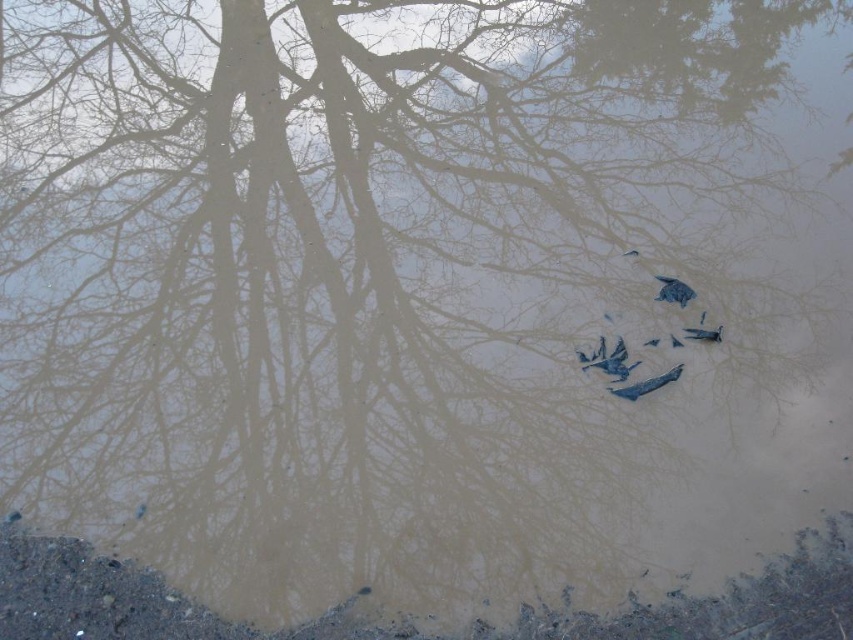
Which is below, blue paper at center or blue matte bird at center?

blue paper at center is below.

Which is in front, point (665, 378) or point (671, 301)?

Positioned in front is point (665, 378).

Locate an element on the screen. blue paper at center is located at coordinates (646, 385).

Can you confirm if muddy brown at bottom is positioned above blue feathered bird at center?

No, muddy brown at bottom is not above blue feathered bird at center.

You are a GUI agent. You are given a task and a screenshot of the screen. Output one action in this format:
    pyautogui.click(x=<x>, y=<y>)
    Task: Click on the muddy brown at bottom
    The height and width of the screenshot is (640, 853).
    Given the screenshot: What is the action you would take?
    pyautogui.click(x=408, y=625)

Is point (811, 609) less distant than point (720, 339)?

Yes, it is.

Who is more distant from viewer, (x=114, y=624) or (x=694, y=336)?

Point (x=694, y=336)

Is point (82, 554) positioned behind point (717, 340)?

No.

The height and width of the screenshot is (640, 853). Identify the location of muddy brown at bottom. click(x=408, y=625).